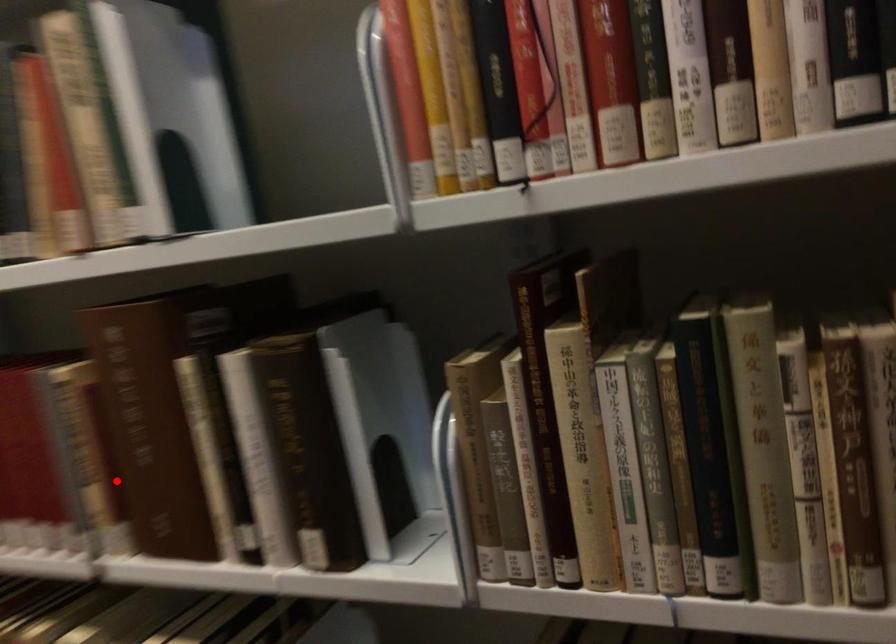
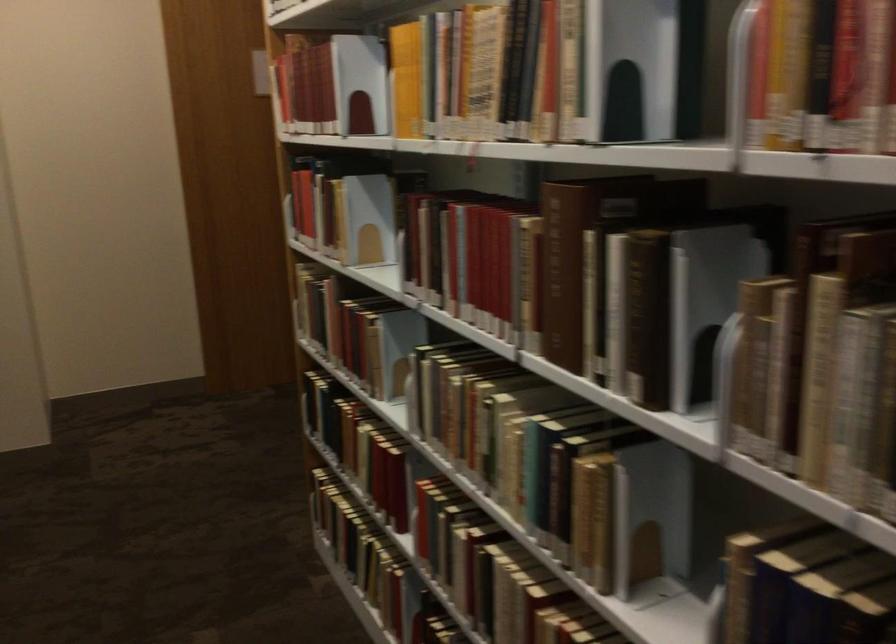
Question: I am providing you with two images of the same scene from different viewpoints. Given a red point in image1, look at the same physical point in image2. Is it:

Choices:
 (A) Closer to the viewpoint
 (B) Farther from the viewpoint

Answer: (B)